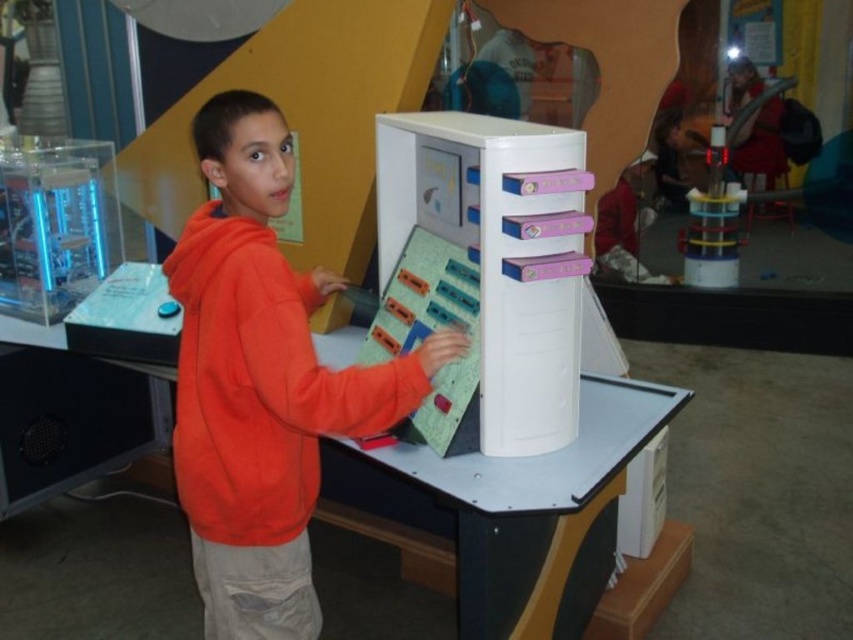
You are a visitor at the science center and want to place your orange fleece at center on the white plastic table at center. Can you move it directly to the right without moving any other objects?

The orange fleece at center is to the left of the white plastic table at center, so you can move it directly to the right onto the table without needing to move other objects.

You are an event planner setting up for a workshop. You have an orange fleece at center and a white plastic table at center. Which object is narrower?

The orange fleece at center is narrower than the white plastic table at center.